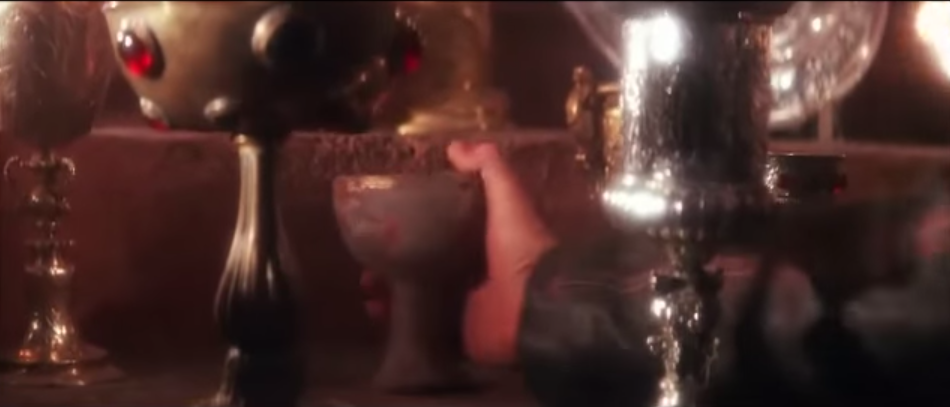
Find the location of a particular element. goblet stems is located at coordinates (258, 241), (47, 192), (407, 321), (680, 261).